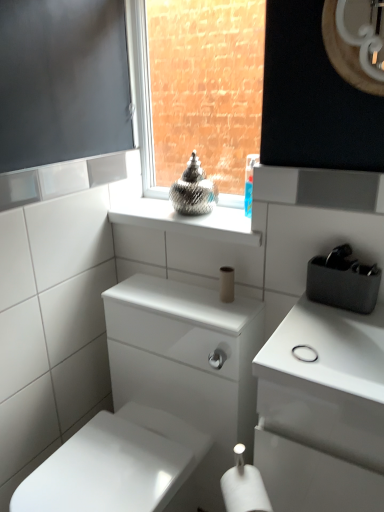
The image size is (384, 512). I want to click on blank space to the left of white matte toilet paper at center, the second toilet paper in the front-to-back sequence, so click(179, 298).